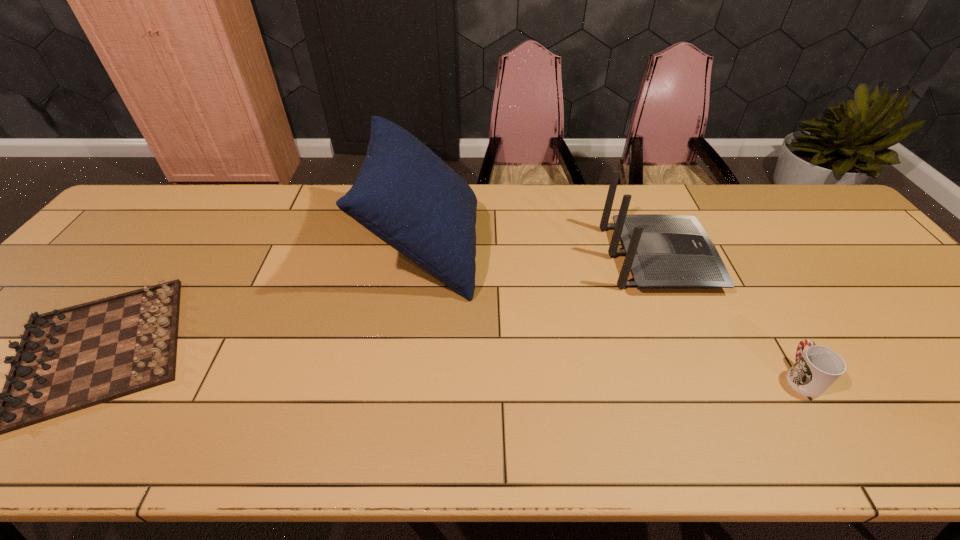
This screenshot has height=540, width=960. What are the coordinates of `object identified as the third closest to the tallest object` in the screenshot? It's located at (815, 370).

Locate an element on the screen. The height and width of the screenshot is (540, 960). vacant region that satisfies the following two spatial constraints: 1. on the front-facing side of the router; 2. on the facing side of the tallest object is located at coordinates (655, 248).

Where is `free space that satisfies the following two spatial constraints: 1. on the side of the cup where the handle is located; 2. on the facing side of the second object from left to right`? free space that satisfies the following two spatial constraints: 1. on the side of the cup where the handle is located; 2. on the facing side of the second object from left to right is located at coordinates (725, 248).

The width and height of the screenshot is (960, 540). What are the coordinates of `free space that satisfies the following two spatial constraints: 1. on the facing side of the second object from left to right; 2. on the front-facing side of the router` in the screenshot? It's located at (425, 258).

At what (x,y) coordinates should I click in order to perform the action: click on free space in the image that satisfies the following two spatial constraints: 1. on the facing side of the cushion; 2. on the side of the rightmost object where the handle is located. Please return your answer as a coordinate pair (x, y). The width and height of the screenshot is (960, 540). Looking at the image, I should click on (409, 376).